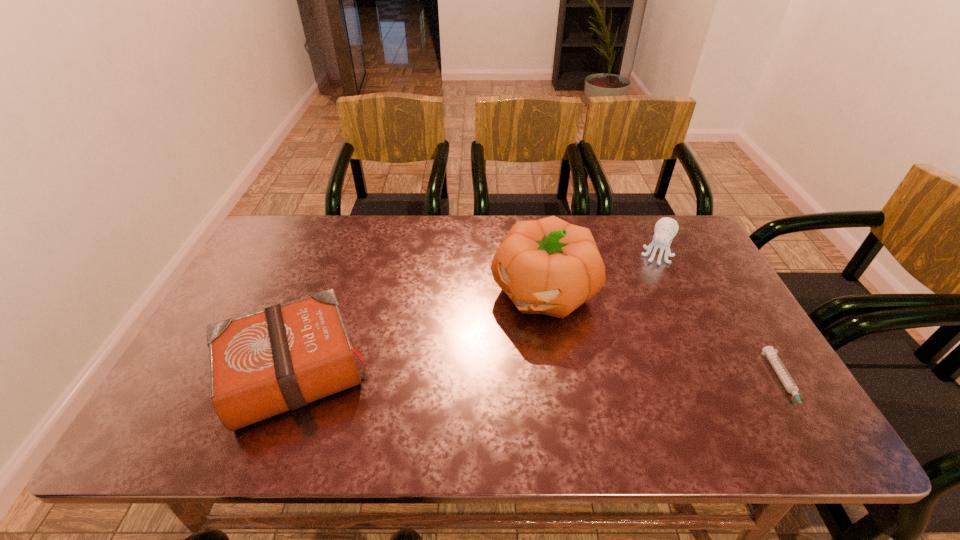
The image size is (960, 540). I want to click on free spot on the desktop that is between the leftmost object and the syringe and is positioned on the front-facing side of the octopus, so click(607, 380).

Where is `free space on the desktop that is between the leftmost object and the rightmost object and is positioned on the carved face of the second object from left to right`? The width and height of the screenshot is (960, 540). free space on the desktop that is between the leftmost object and the rightmost object and is positioned on the carved face of the second object from left to right is located at coordinates (466, 377).